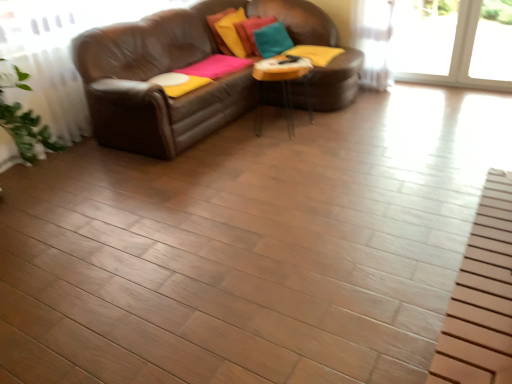
The image size is (512, 384). Describe the element at coordinates (272, 40) in the screenshot. I see `teal fabric pillow at upper center, the 3th pillow when ordered from left to right` at that location.

How much space does velvet teal pillow at upper center, marked as the 2th pillow in a right-to-left arrangement, occupy horizontally?

10.30 inches.

Describe the element at coordinates (251, 32) in the screenshot. I see `velvet teal pillow at upper center, marked as the 2th pillow in a right-to-left arrangement` at that location.

Identify the location of clear glass table at center. The image size is (512, 384). (281, 84).

What do you see at coordinates (232, 32) in the screenshot? Image resolution: width=512 pixels, height=384 pixels. I see `velvet yellow pillow at upper center, marked as the 1th pillow in a left-to-right arrangement` at bounding box center [232, 32].

At what (x,y) coordinates should I click in order to perform the action: click on teal fabric pillow at upper center, which is counted as the 1th pillow, starting from the right. Please return your answer as a coordinate pair (x, y). The width and height of the screenshot is (512, 384). Looking at the image, I should click on tap(272, 40).

Image resolution: width=512 pixels, height=384 pixels. Find the location of `pillow that is the 1st one when counting leftward from the teal fabric pillow at upper center, which is counted as the 1th pillow, starting from the right`. pillow that is the 1st one when counting leftward from the teal fabric pillow at upper center, which is counted as the 1th pillow, starting from the right is located at coordinates (251, 32).

From a real-world perspective, is teal fabric pillow at upper center, the 3th pillow when ordered from left to right, below velvet teal pillow at upper center, the 2th pillow in the left-to-right sequence?

Yes, from a real-world perspective, teal fabric pillow at upper center, the 3th pillow when ordered from left to right, is beneath velvet teal pillow at upper center, the 2th pillow in the left-to-right sequence.

Considering the relative positions of teal fabric pillow at upper center, the 3th pillow when ordered from left to right, and velvet teal pillow at upper center, marked as the 2th pillow in a right-to-left arrangement, in the image provided, is teal fabric pillow at upper center, the 3th pillow when ordered from left to right, to the right of velvet teal pillow at upper center, marked as the 2th pillow in a right-to-left arrangement, from the viewer's perspective?

Correct, you'll find teal fabric pillow at upper center, the 3th pillow when ordered from left to right, to the right of velvet teal pillow at upper center, marked as the 2th pillow in a right-to-left arrangement.

This screenshot has height=384, width=512. I want to click on the 1st pillow to the left of the teal fabric pillow at upper center, the 3th pillow when ordered from left to right, counting from the anchor's position, so coord(251,32).

Looking at this image, can we say velvet teal pillow at upper center, marked as the 2th pillow in a right-to-left arrangement, lies outside teal fabric pillow at upper center, which is counted as the 1th pillow, starting from the right?

Yes, velvet teal pillow at upper center, marked as the 2th pillow in a right-to-left arrangement, is outside of teal fabric pillow at upper center, which is counted as the 1th pillow, starting from the right.

Based on the photo, does velvet teal pillow at upper center, the 2th pillow in the left-to-right sequence, touch teal fabric pillow at upper center, which is counted as the 1th pillow, starting from the right?

velvet teal pillow at upper center, the 2th pillow in the left-to-right sequence, is not next to teal fabric pillow at upper center, which is counted as the 1th pillow, starting from the right, and they're not touching.

From a real-world perspective, is clear glass table at center over teal fabric pillow at upper center, which is counted as the 1th pillow, starting from the right?

No, from a real-world perspective, clear glass table at center is not on top of teal fabric pillow at upper center, which is counted as the 1th pillow, starting from the right.

From the image's perspective, would you say clear glass table at center is shown under teal fabric pillow at upper center, which is counted as the 1th pillow, starting from the right?

Correct, clear glass table at center appears lower than teal fabric pillow at upper center, which is counted as the 1th pillow, starting from the right, in the image.

Between clear glass table at center and teal fabric pillow at upper center, which is counted as the 1th pillow, starting from the right, which one has larger width?

With larger width is clear glass table at center.

Considering their positions, is clear glass table at center located in front of or behind teal fabric pillow at upper center, the 3th pillow when ordered from left to right?

clear glass table at center is in front of teal fabric pillow at upper center, the 3th pillow when ordered from left to right.

From a real-world perspective, is teal fabric pillow at upper center, the 3th pillow when ordered from left to right, above or below velvet yellow pillow at upper center, placed as the third pillow when sorted from right to left?

teal fabric pillow at upper center, the 3th pillow when ordered from left to right, is situated lower than velvet yellow pillow at upper center, placed as the third pillow when sorted from right to left, in the real world.

How far apart are teal fabric pillow at upper center, which is counted as the 1th pillow, starting from the right, and velvet yellow pillow at upper center, marked as the 1th pillow in a left-to-right arrangement?

They are 10.45 inches apart.

Which object is wider, teal fabric pillow at upper center, which is counted as the 1th pillow, starting from the right, or velvet yellow pillow at upper center, marked as the 1th pillow in a left-to-right arrangement?

Wider between the two is teal fabric pillow at upper center, which is counted as the 1th pillow, starting from the right.

How different are the orientations of teal fabric pillow at upper center, the 3th pillow when ordered from left to right, and velvet yellow pillow at upper center, marked as the 1th pillow in a left-to-right arrangement, in degrees?

22.6 degrees.

Between velvet teal pillow at upper center, the 2th pillow in the left-to-right sequence, and clear glass table at center, which one has more height?

With more height is clear glass table at center.

Is point (262, 22) farther from camera compared to point (260, 124)?

Yes, it is.

From a real-world perspective, is velvet teal pillow at upper center, the 2th pillow in the left-to-right sequence, located higher than clear glass table at center?

Yes, from a real-world perspective, velvet teal pillow at upper center, the 2th pillow in the left-to-right sequence, is on top of clear glass table at center.

In the scene shown: Which of these two, velvet teal pillow at upper center, the 2th pillow in the left-to-right sequence, or clear glass table at center, is wider?

clear glass table at center.

Which of these two, clear glass table at center or velvet yellow pillow at upper center, marked as the 1th pillow in a left-to-right arrangement, is wider?

With larger width is clear glass table at center.

Is clear glass table at center with velvet yellow pillow at upper center, marked as the 1th pillow in a left-to-right arrangement?

No, clear glass table at center is not next to velvet yellow pillow at upper center, marked as the 1th pillow in a left-to-right arrangement.

Could you measure the distance between clear glass table at center and velvet yellow pillow at upper center, marked as the 1th pillow in a left-to-right arrangement?

The distance of clear glass table at center from velvet yellow pillow at upper center, marked as the 1th pillow in a left-to-right arrangement, is 23.40 inches.

Can you confirm if clear glass table at center is taller than velvet yellow pillow at upper center, marked as the 1th pillow in a left-to-right arrangement?

Correct, clear glass table at center is much taller as velvet yellow pillow at upper center, marked as the 1th pillow in a left-to-right arrangement.

Is velvet yellow pillow at upper center, placed as the third pillow when sorted from right to left, outside of teal fabric pillow at upper center, the 3th pillow when ordered from left to right?

That's correct, velvet yellow pillow at upper center, placed as the third pillow when sorted from right to left, is outside of teal fabric pillow at upper center, the 3th pillow when ordered from left to right.

Who is smaller, velvet yellow pillow at upper center, placed as the third pillow when sorted from right to left, or teal fabric pillow at upper center, which is counted as the 1th pillow, starting from the right?

teal fabric pillow at upper center, which is counted as the 1th pillow, starting from the right, is smaller.

Where is `pillow that is the 1st one when counting upward from the teal fabric pillow at upper center, which is counted as the 1th pillow, starting from the right (from the image's perspective)`? pillow that is the 1st one when counting upward from the teal fabric pillow at upper center, which is counted as the 1th pillow, starting from the right (from the image's perspective) is located at coordinates (251, 32).

Starting from the teal fabric pillow at upper center, the 3th pillow when ordered from left to right, which pillow is the 2nd one behind? Please provide its 2D coordinates.

[(251, 32)]

Estimate the real-world distances between objects in this image. Which object is closer to clear glass table at center, velvet yellow pillow at upper center, placed as the third pillow when sorted from right to left, or teal fabric pillow at upper center, which is counted as the 1th pillow, starting from the right?

teal fabric pillow at upper center, which is counted as the 1th pillow, starting from the right.

When comparing their distances from velvet teal pillow at upper center, marked as the 2th pillow in a right-to-left arrangement, does clear glass table at center or velvet yellow pillow at upper center, placed as the third pillow when sorted from right to left, seem further?

clear glass table at center is further to velvet teal pillow at upper center, marked as the 2th pillow in a right-to-left arrangement.

Estimate the real-world distances between objects in this image. Which object is further from clear glass table at center, teal fabric pillow at upper center, the 3th pillow when ordered from left to right, or velvet teal pillow at upper center, the 2th pillow in the left-to-right sequence?

The object further to clear glass table at center is velvet teal pillow at upper center, the 2th pillow in the left-to-right sequence.

Based on their spatial positions, is velvet yellow pillow at upper center, placed as the third pillow when sorted from right to left, or clear glass table at center further from teal fabric pillow at upper center, the 3th pillow when ordered from left to right?

The object further to teal fabric pillow at upper center, the 3th pillow when ordered from left to right, is clear glass table at center.

From the image, which object appears to be farther from velvet yellow pillow at upper center, placed as the third pillow when sorted from right to left, teal fabric pillow at upper center, which is counted as the 1th pillow, starting from the right, or velvet teal pillow at upper center, marked as the 2th pillow in a right-to-left arrangement?

teal fabric pillow at upper center, which is counted as the 1th pillow, starting from the right, is positioned further to the anchor velvet yellow pillow at upper center, placed as the third pillow when sorted from right to left.

In the scene shown: Based on their spatial positions, is velvet yellow pillow at upper center, placed as the third pillow when sorted from right to left, or teal fabric pillow at upper center, the 3th pillow when ordered from left to right, closer to velvet teal pillow at upper center, the 2th pillow in the left-to-right sequence?

velvet yellow pillow at upper center, placed as the third pillow when sorted from right to left, is positioned closer to the anchor velvet teal pillow at upper center, the 2th pillow in the left-to-right sequence.

Which object lies nearer to the anchor point velvet teal pillow at upper center, marked as the 2th pillow in a right-to-left arrangement, teal fabric pillow at upper center, the 3th pillow when ordered from left to right, or clear glass table at center?

teal fabric pillow at upper center, the 3th pillow when ordered from left to right, is closer to velvet teal pillow at upper center, marked as the 2th pillow in a right-to-left arrangement.

From the picture: Which object lies further to the anchor point clear glass table at center, velvet yellow pillow at upper center, placed as the third pillow when sorted from right to left, or velvet teal pillow at upper center, the 2th pillow in the left-to-right sequence?

The object further to clear glass table at center is velvet yellow pillow at upper center, placed as the third pillow when sorted from right to left.

The width and height of the screenshot is (512, 384). I want to click on pillow between clear glass table at center and velvet yellow pillow at upper center, marked as the 1th pillow in a left-to-right arrangement, from front to back, so point(272,40).

You are a GUI agent. You are given a task and a screenshot of the screen. Output one action in this format:
    pyautogui.click(x=<x>, y=<y>)
    Task: Click on the pillow located between velvet yellow pillow at upper center, placed as the third pillow when sorted from right to left, and teal fabric pillow at upper center, which is counted as the 1th pillow, starting from the right, in the left-right direction
    
    Given the screenshot: What is the action you would take?
    pyautogui.click(x=251, y=32)